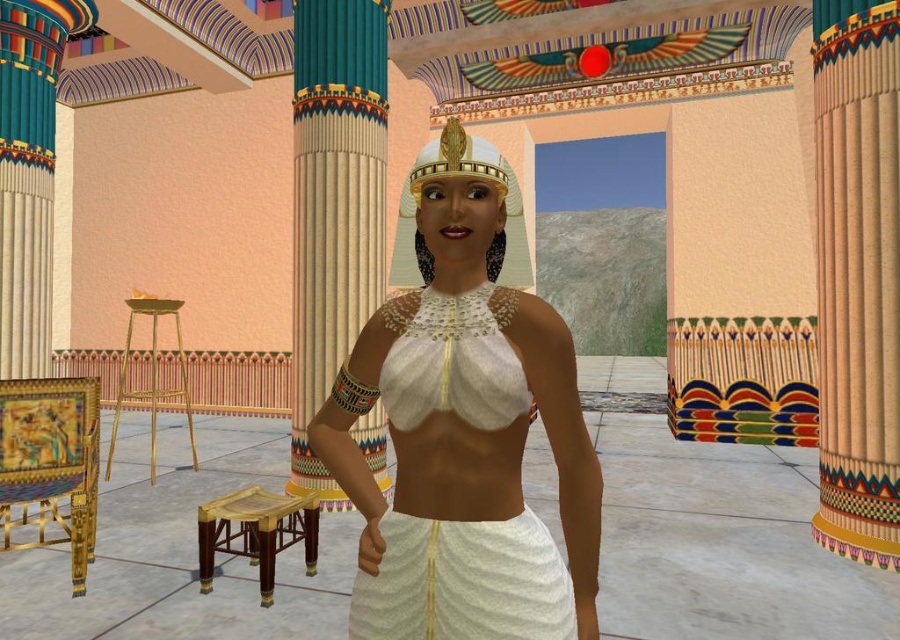
Which is behind, point (504, 252) or point (286, 541)?

Positioned behind is point (286, 541).

Which is behind, point (469, 134) or point (304, 504)?

Point (469, 134)

Where is `white glossy headdress at center`? white glossy headdress at center is located at coordinates (460, 173).

Is the position of white matte fabric at center more distant than that of smooth beige column at center?

No, it is in front of smooth beige column at center.

Does white matte fabric at center appear on the right side of smooth beige column at center?

Correct, you'll find white matte fabric at center to the right of smooth beige column at center.

Between point (497, 394) and point (387, 474), which one is positioned behind?

The point (387, 474) is more distant.

Image resolution: width=900 pixels, height=640 pixels. Identify the location of white matte fabric at center. (464, 388).

I want to click on beige textured column at right, so click(x=857, y=275).

Is beige textured column at right positioned behind wooden stool at lower left?

Yes, beige textured column at right is behind wooden stool at lower left.

Between point (892, 488) and point (245, 497), which one is positioned in front?

Point (245, 497) is in front.

You are a GUI agent. You are given a task and a screenshot of the screen. Output one action in this format:
    pyautogui.click(x=<x>, y=<y>)
    Task: Click on the beige textured column at right
    The image size is (900, 640).
    Given the screenshot: What is the action you would take?
    pyautogui.click(x=857, y=275)